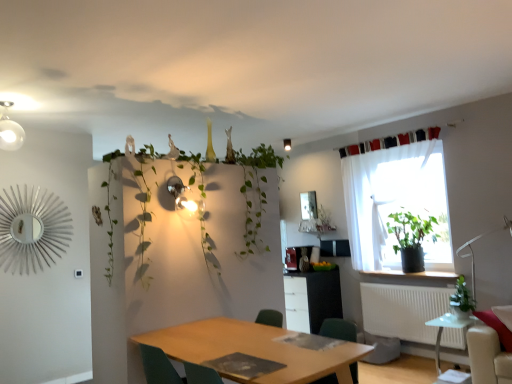
At what (x,y) coordinates should I click in order to perform the action: click on empty space that is ontop of white plastic radiator at lower right (from a real-world perspective). Please return your answer as a coordinate pair (x, y). The image size is (512, 384). Looking at the image, I should click on (410, 282).